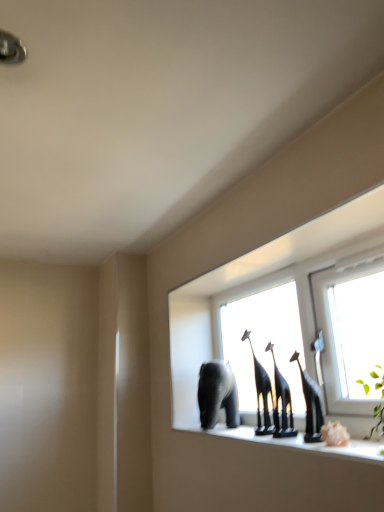
Question: Can you confirm if transparent glass window at center is bigger than gray matte elephant at center?

Choices:
 (A) yes
 (B) no

Answer: (A)

Question: Is transparent glass window at center further to the viewer compared to gray matte elephant at center?

Choices:
 (A) no
 (B) yes

Answer: (A)

Question: Is transparent glass window at center not inside gray matte elephant at center?

Choices:
 (A) yes
 (B) no

Answer: (A)

Question: Can you confirm if transparent glass window at center is positioned to the right of gray matte elephant at center?

Choices:
 (A) yes
 (B) no

Answer: (A)

Question: Is transparent glass window at center oriented away from gray matte elephant at center?

Choices:
 (A) yes
 (B) no

Answer: (A)

Question: From a real-world perspective, is transparent glass window at center on gray matte elephant at center?

Choices:
 (A) yes
 (B) no

Answer: (A)

Question: From a real-world perspective, is black glossy giraffe at center positioned under gray matte elephant at center based on gravity?

Choices:
 (A) yes
 (B) no

Answer: (B)

Question: Is black glossy giraffe at center behind gray matte elephant at center?

Choices:
 (A) yes
 (B) no

Answer: (B)

Question: Would you consider black glossy giraffe at center to be distant from gray matte elephant at center?

Choices:
 (A) no
 (B) yes

Answer: (A)

Question: Does black glossy giraffe at center appear on the left side of gray matte elephant at center?

Choices:
 (A) yes
 (B) no

Answer: (B)

Question: Is black glossy giraffe at center turned away from gray matte elephant at center?

Choices:
 (A) yes
 (B) no

Answer: (B)

Question: From a real-world perspective, is black glossy giraffe at center on top of gray matte elephant at center?

Choices:
 (A) yes
 (B) no

Answer: (A)

Question: Is gray matte elephant at center aimed at black glossy giraffe at center?

Choices:
 (A) no
 (B) yes

Answer: (A)